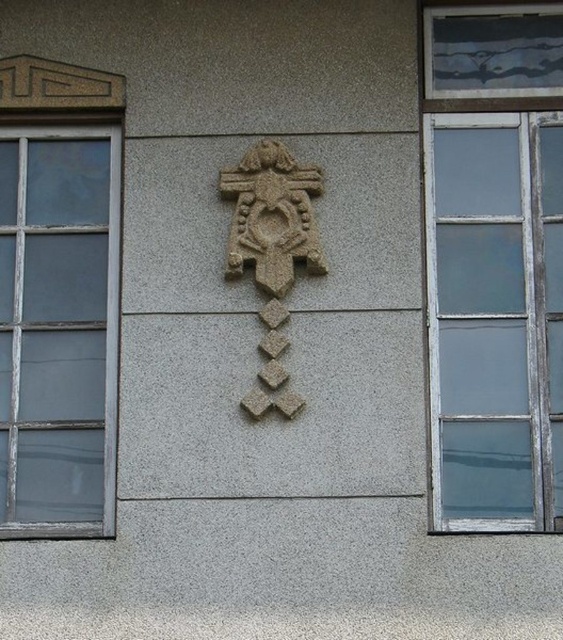
Question: Can you confirm if clear glass window at right is wider than clear glass window at left?

Choices:
 (A) no
 (B) yes

Answer: (B)

Question: Does clear glass window at left have a larger size compared to granite stone cross at center?

Choices:
 (A) no
 (B) yes

Answer: (B)

Question: Is clear glass window at right thinner than granite stone cross at center?

Choices:
 (A) yes
 (B) no

Answer: (B)

Question: Which of the following is the closest to the observer?

Choices:
 (A) (453, 326)
 (B) (7, 433)

Answer: (B)

Question: Estimate the real-world distances between objects in this image. Which object is closer to the clear glass window at right?

Choices:
 (A) granite stone cross at center
 (B) clear glass window at left

Answer: (A)

Question: Which of the following is the closest to the observer?

Choices:
 (A) (x=10, y=253)
 (B) (x=553, y=500)

Answer: (B)